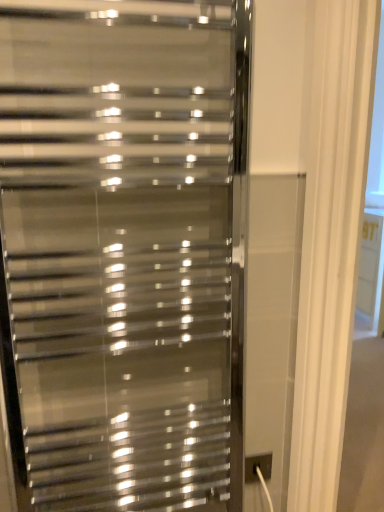
This screenshot has height=512, width=384. What do you see at coordinates (122, 251) in the screenshot?
I see `transparent plastic door at center` at bounding box center [122, 251].

You are a GUI agent. You are given a task and a screenshot of the screen. Output one action in this format:
    pyautogui.click(x=<x>, y=<y>)
    Task: Click on the transparent plastic door at center
    The image size is (384, 512).
    Given the screenshot: What is the action you would take?
    pyautogui.click(x=122, y=251)

Locate an element on the screen. Image resolution: width=384 pixels, height=512 pixels. transparent plastic door at center is located at coordinates (122, 251).